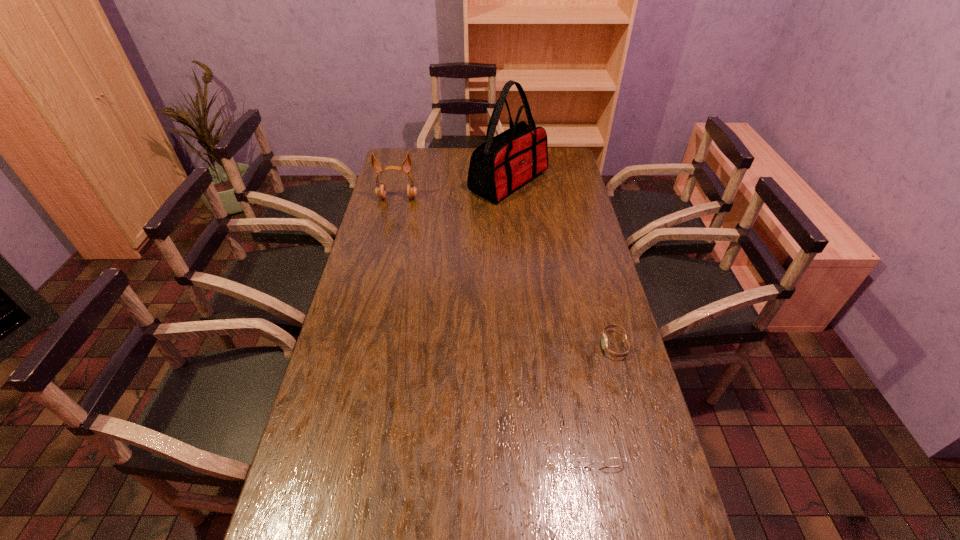
Image resolution: width=960 pixels, height=540 pixels. In order to click on duffel bag in this screenshot , I will do `click(502, 164)`.

This screenshot has height=540, width=960. Find the location of `earphone`. earphone is located at coordinates (380, 191).

Find the location of a particular element. the second tallest object is located at coordinates (380, 191).

The height and width of the screenshot is (540, 960). Identify the location of spectacles. (582, 461).

Locate an element on the screen. watch is located at coordinates (604, 342).

Where is `the rightmost object`? This screenshot has height=540, width=960. the rightmost object is located at coordinates (604, 342).

Identify the location of free space located 0.350m on the left of the duffel bag. (390, 181).

Where is `vacant space located 0.080m on the front-facing side of the leftmost object`? This screenshot has width=960, height=540. vacant space located 0.080m on the front-facing side of the leftmost object is located at coordinates (394, 214).

Where is `free space located 0.070m on the front-facing side of the nearest object`? The image size is (960, 540). free space located 0.070m on the front-facing side of the nearest object is located at coordinates (602, 500).

At what (x,y) coordinates should I click in order to perform the action: click on free region located 0.210m on the face of the second nearest object. Please return your answer as a coordinate pair (x, y). Looking at the image, I should click on (531, 345).